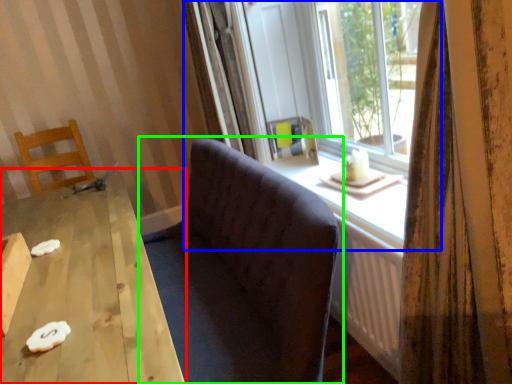
Question: Considering the real-world distances, which object is farthest from table (highlighted by a red box)? window (highlighted by a blue box) or studio couch (highlighted by a green box)?

Choices:
 (A) window
 (B) studio couch

Answer: (A)